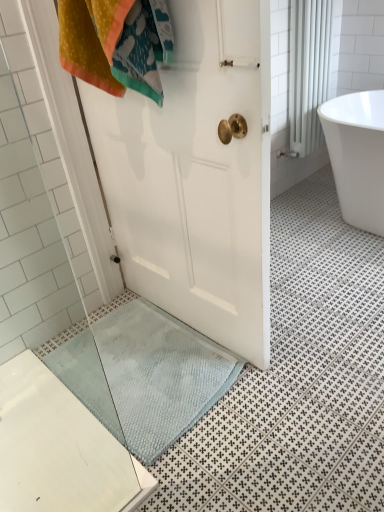
At what (x,y) coordinates should I click in order to perform the action: click on vacant space situated above blue textured bath mat at lower center (from a real-world perspective). Please return your answer as a coordinate pair (x, y). The height and width of the screenshot is (512, 384). Looking at the image, I should click on (150, 358).